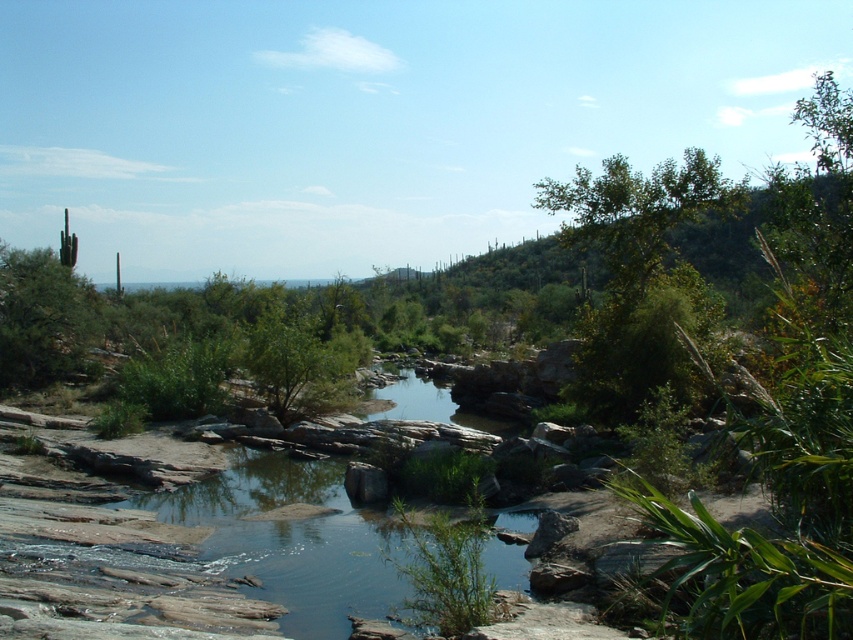
Question: Considering the relative positions of green leafy tree at upper right and green spiky cactus at upper left in the image provided, where is green leafy tree at upper right located with respect to green spiky cactus at upper left?

Choices:
 (A) left
 (B) right

Answer: (B)

Question: Does green leafy tree at upper right appear on the left side of green spiky cactus at upper left?

Choices:
 (A) yes
 (B) no

Answer: (B)

Question: Is green leafy tree at upper right above green spiky cactus at upper left?

Choices:
 (A) yes
 (B) no

Answer: (A)

Question: Which point is closer to the camera?

Choices:
 (A) green leafy tree at upper right
 (B) green spiky cactus at upper left

Answer: (A)

Question: Which point is farther to the camera?

Choices:
 (A) (589, 388)
 (B) (50, 353)

Answer: (B)